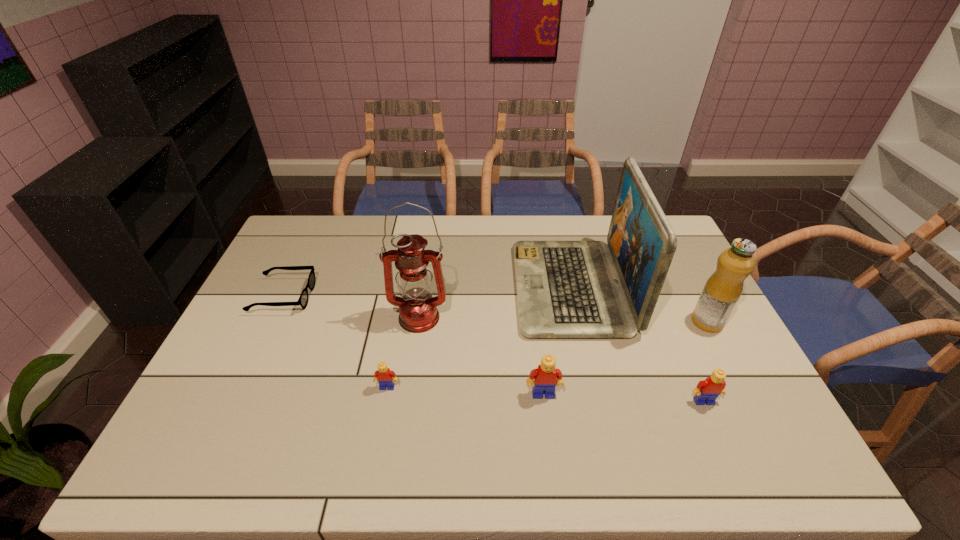
In order to click on vacant area at the right edge in this screenshot , I will do `click(674, 273)`.

Image resolution: width=960 pixels, height=540 pixels. I want to click on free spot at the far left corner of the desktop, so click(x=297, y=224).

Identify the location of free space between the oil lamp and the laptop computer. This screenshot has height=540, width=960. (494, 303).

In order to click on vacant space that's between the leftmost Lego and the laptop computer in this screenshot , I will do `click(479, 338)`.

Find the location of `vacant point located between the leftmost Lego and the tallest Lego`. vacant point located between the leftmost Lego and the tallest Lego is located at coordinates (466, 391).

Identify the location of blank region between the fourth tallest object and the third tallest object. (625, 358).

Locate an element on the screen. empty space between the oil lamp and the leftmost object is located at coordinates (350, 307).

You are a GUI agent. You are given a task and a screenshot of the screen. Output one action in this format:
    pyautogui.click(x=<x>, y=<y>)
    Task: Click on the free space between the fourth tallest object and the second shortest Lego
    This screenshot has height=540, width=960.
    Given the screenshot: What is the action you would take?
    pyautogui.click(x=624, y=398)

This screenshot has width=960, height=540. I want to click on vacant area that lies between the rightmost Lego and the shortest object, so click(493, 349).

Where is `empty space between the leftmost Lego and the shortest object`? This screenshot has width=960, height=540. empty space between the leftmost Lego and the shortest object is located at coordinates (335, 342).